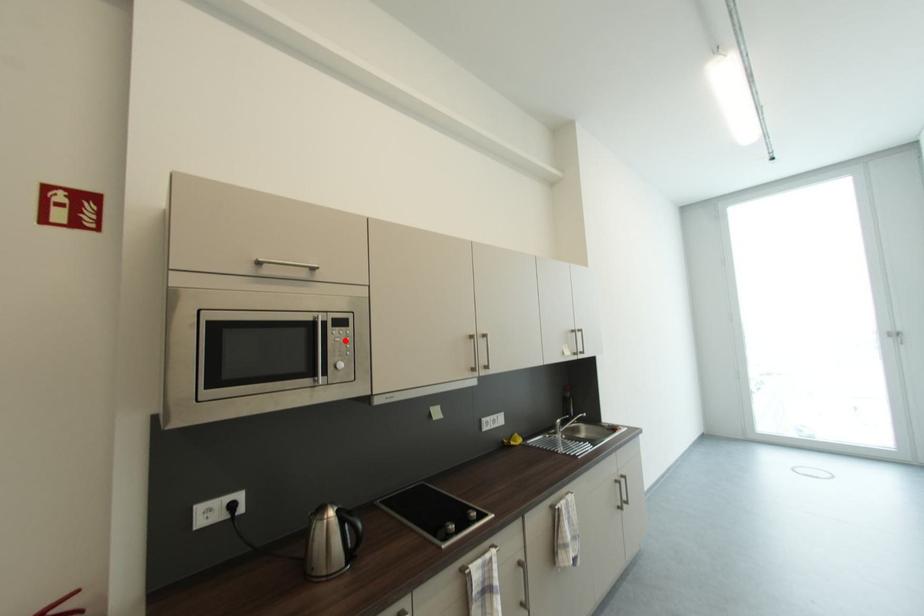
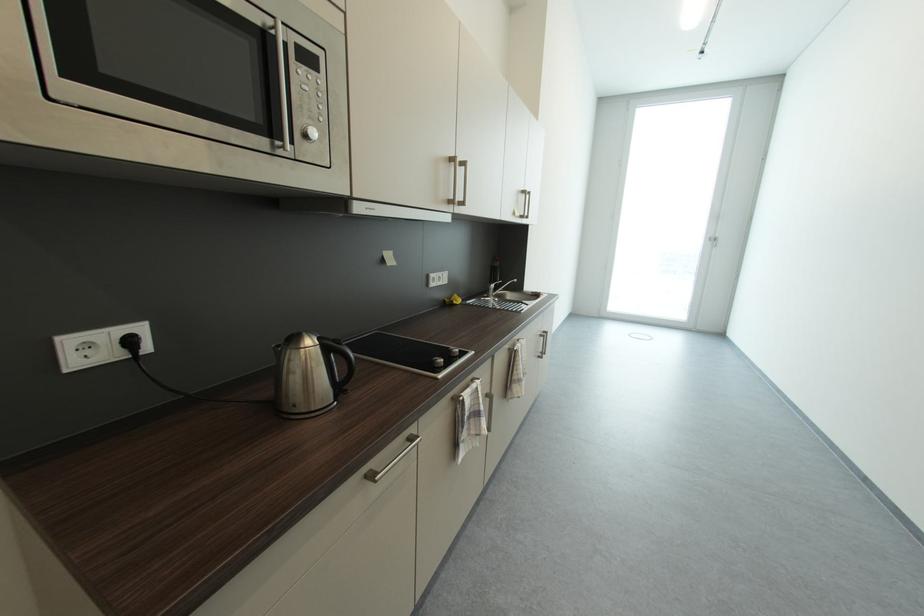
The point at the highlighted location is marked in the first image. Where is the corresponding point in the second image?

(313, 89)